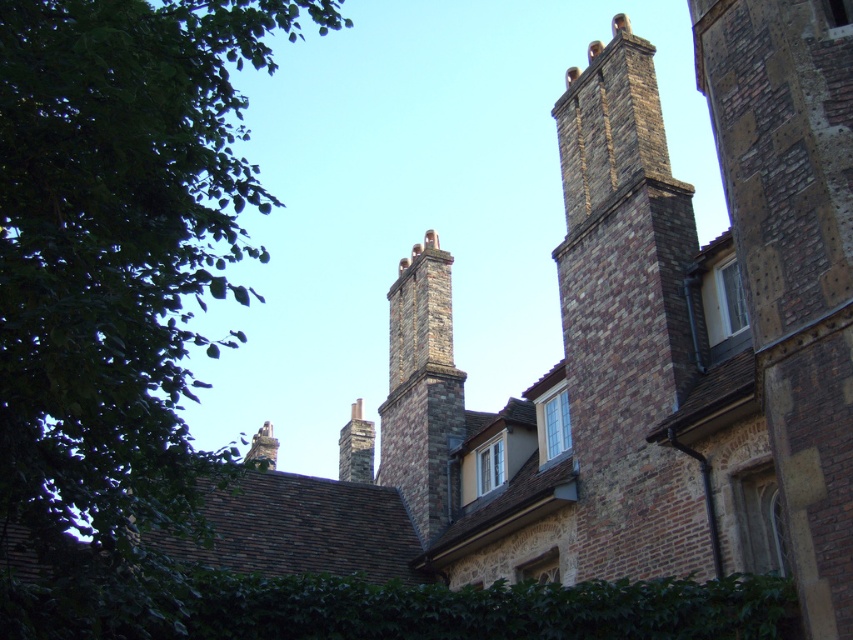
Is brown stone chimney at center taller than stone chimney at center?

Indeed, brown stone chimney at center has a greater height compared to stone chimney at center.

Is point (425, 330) positioned before point (349, 461)?

Yes.

Is point (426, 282) in front of point (358, 432)?

Yes, point (426, 282) is closer to viewer.

You are a GUI agent. You are given a task and a screenshot of the screen. Output one action in this format:
    pyautogui.click(x=<x>, y=<y>)
    Task: Click on the brown stone chimney at center
    This screenshot has width=853, height=640.
    Given the screenshot: What is the action you would take?
    pyautogui.click(x=421, y=388)

Between brown stone chimney at center and smooth stone chimney at upper center, which one is positioned lower?

Positioned lower is smooth stone chimney at upper center.

Between point (428, 452) and point (260, 429), which one is positioned in front?

Point (428, 452) is in front.

Where is `brown stone chimney at center`? brown stone chimney at center is located at coordinates (421, 388).

What do you see at coordinates (627, 321) in the screenshot? The height and width of the screenshot is (640, 853). I see `brown brick chimney at upper right` at bounding box center [627, 321].

Is brown brick chimney at upper right wider than brown stone chimney at center?

Incorrect, brown brick chimney at upper right's width does not surpass brown stone chimney at center's.

Image resolution: width=853 pixels, height=640 pixels. What do you see at coordinates (627, 321) in the screenshot? I see `brown brick chimney at upper right` at bounding box center [627, 321].

Where is `brown brick chimney at upper right`? brown brick chimney at upper right is located at coordinates (627, 321).